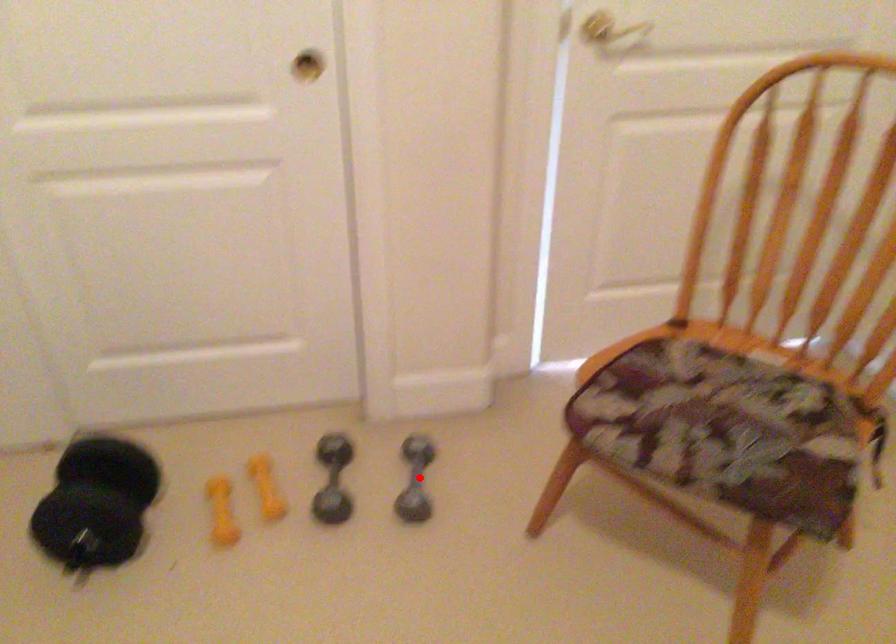
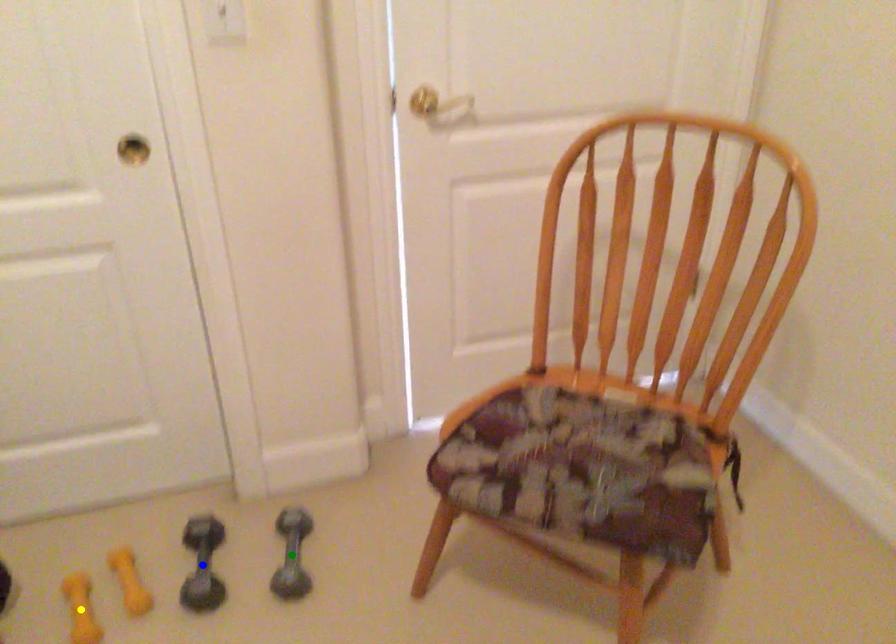
Question: I am providing you with two images of the same scene from different viewpoints. A red point is marked on the first image. You are given multiple points on the second image. Which spot in image 2 lines up with the point in image 1?

Choices:
 (A) blue point
 (B) yellow point
 (C) green point

Answer: (C)